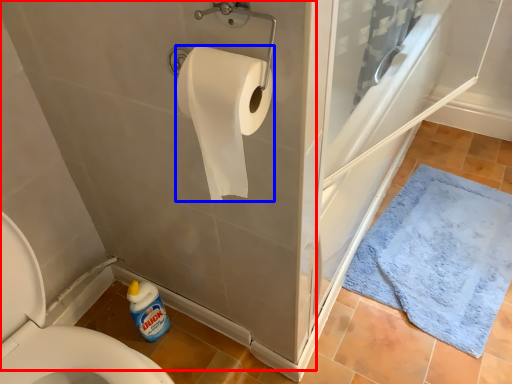
Question: Which of the following is the closest to the observer, bath (highlighted by a red box) or toilet paper (highlighted by a blue box)?

Choices:
 (A) bath
 (B) toilet paper

Answer: (A)